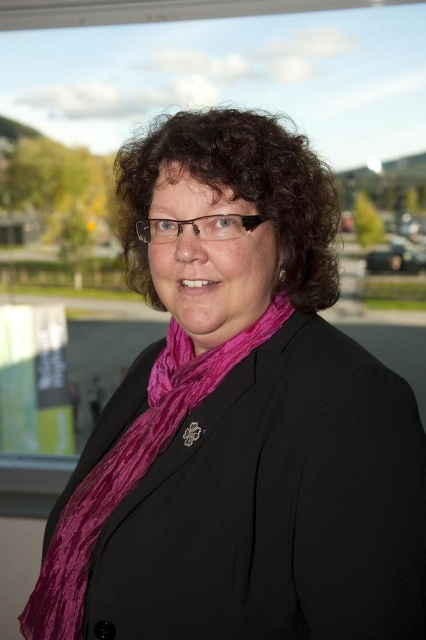
Question: Which point is farther to the camera?

Choices:
 (A) dark brown curly hair at center
 (B) velvet purple scarf at center

Answer: (B)

Question: Can you confirm if dark brown curly hair at center is bigger than velvet purple scarf at center?

Choices:
 (A) no
 (B) yes

Answer: (A)

Question: Is dark brown curly hair at center above velvet purple scarf at center?

Choices:
 (A) yes
 (B) no

Answer: (A)

Question: Is dark brown curly hair at center thinner than velvet purple scarf at center?

Choices:
 (A) yes
 (B) no

Answer: (A)